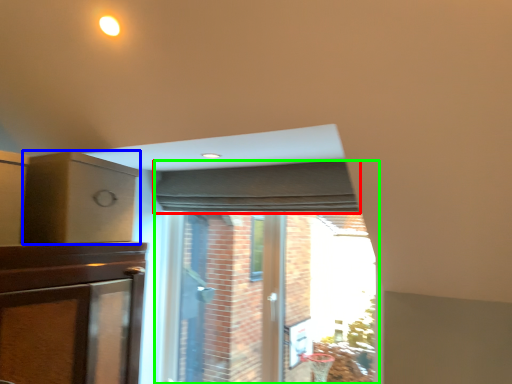
Question: Which object is positioned farthest from curtain (highlighted by a red box)? Select from cabinetry (highlighted by a blue box) and bay window (highlighted by a green box).

Choices:
 (A) cabinetry
 (B) bay window

Answer: (A)